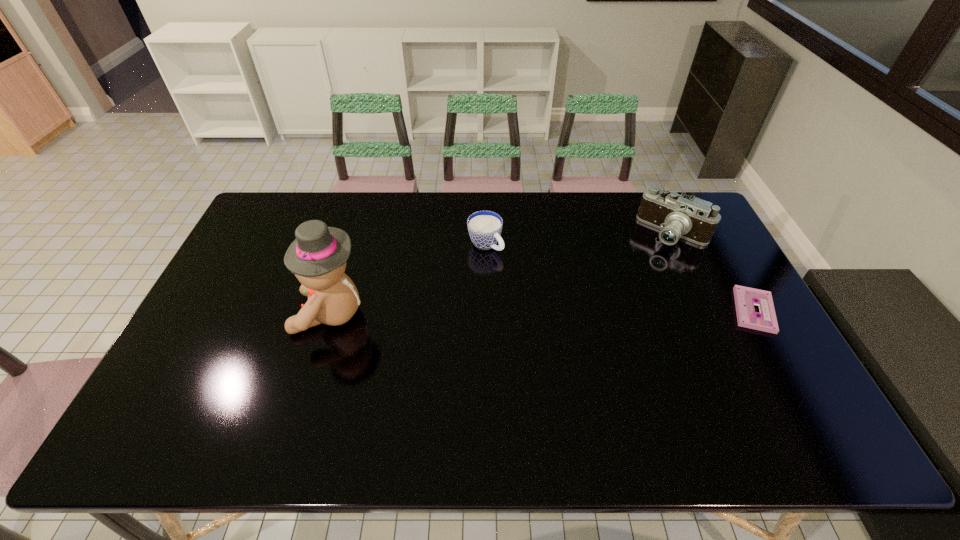
Identify the location of object that is at the far right corner. (677, 216).

Locate an element on the screen. vacant space at the far edge of the desktop is located at coordinates (551, 211).

In the image, there is a desktop. At what (x,y) coordinates should I click in order to perform the action: click on free space at the near edge. Please return your answer as a coordinate pair (x, y). Image resolution: width=960 pixels, height=540 pixels. Looking at the image, I should click on (582, 402).

Identify the location of free space at the left edge of the desktop. (286, 251).

Locate an element on the screen. free spot between the tallest object and the second object from left to right is located at coordinates (408, 279).

Locate an element on the screen. Image resolution: width=960 pixels, height=540 pixels. free space between the videotape and the tallest object is located at coordinates (542, 312).

Identify the location of empty location between the second tallest object and the cup. Image resolution: width=960 pixels, height=540 pixels. (580, 239).

I want to click on free space that is in between the tallest object and the second object from left to right, so click(x=408, y=279).

The height and width of the screenshot is (540, 960). What are the coordinates of `free space between the leftmost object and the shortest object` in the screenshot? It's located at (542, 312).

The image size is (960, 540). What are the coordinates of `unoccupied area between the shortest object and the tallest object` in the screenshot? It's located at (542, 312).